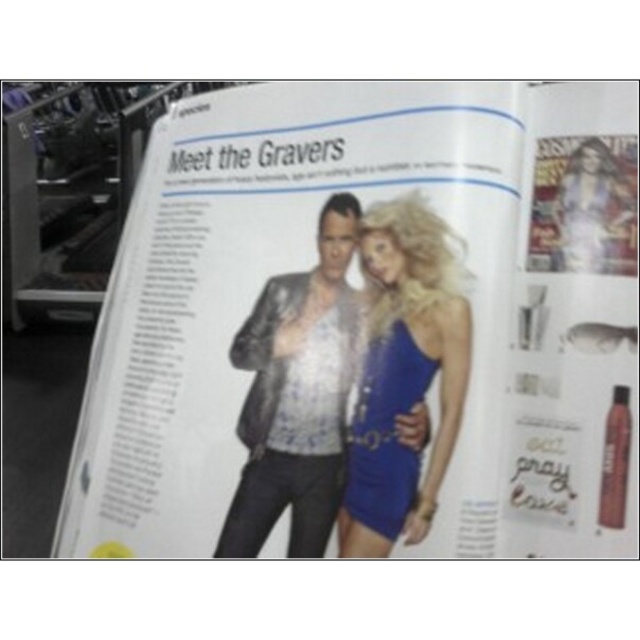
You are designing a layout for a magazine cover. You have a matte black magazine at center and a shiny blue dress at center. Which object should you place first if you want to prioritize the larger item in your design?

The matte black magazine at center should be placed first because its width is larger than the shiny blue dress at center, making it the larger item to prioritize in the design.

You are a fashion designer who wants to create a new outfit that matches the style of the shiny black leather jacket at center and the shiny blue dress at center. Which one of these items should you consider first for the base design, and why?

The shiny black leather jacket at center is larger in size than the shiny blue dress at center, so you should consider the shiny black leather jacket at center first as the base design since its larger size might dominate the overall look and set the tone for the collection.

You are designing a layout for a magazine cover. You want to place a new element at position point 0.5, 0.5. Will the matte black magazine at center block your placement?

The matte black magazine at center is at position point [369,326], which is very close to the desired point [320,320]. Depending on the size of the new element and the magazine, there might be an overlap. However, since the magazine is already placed at that approximate location, it could block the new element unless adjustments are made.